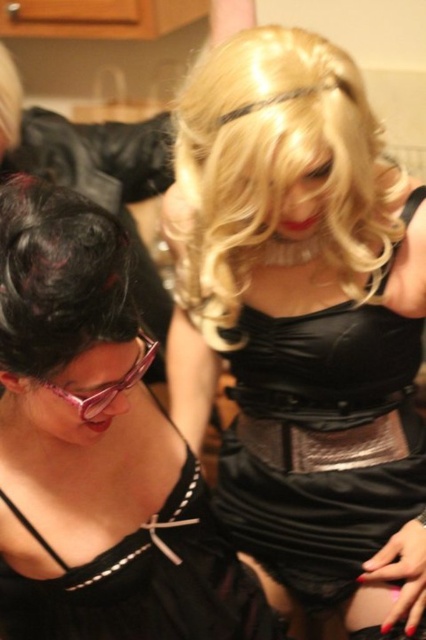
Question: Observing the image, what is the correct spatial positioning of black satin dress at center in reference to pink plastic goggles at lower left?

Choices:
 (A) above
 (B) below

Answer: (B)

Question: Which object is closer to the camera taking this photo?

Choices:
 (A) satin black dress at center
 (B) shiny black hair at lower left
 (C) pink plastic goggles at lower left

Answer: (B)

Question: Can you confirm if black satin dress at center is smaller than blondehair at upper center?

Choices:
 (A) no
 (B) yes

Answer: (A)

Question: Estimate the real-world distances between objects in this image. Which object is farther from the blondehair at upper center?

Choices:
 (A) black satin dress at center
 (B) satin black dress at center
 (C) shiny black hair at lower left

Answer: (C)

Question: Which of the following is the farthest from the observer?

Choices:
 (A) (224, 252)
 (B) (48, 280)

Answer: (A)

Question: Is black satin dress at center below pink plastic goggles at lower left?

Choices:
 (A) no
 (B) yes

Answer: (B)